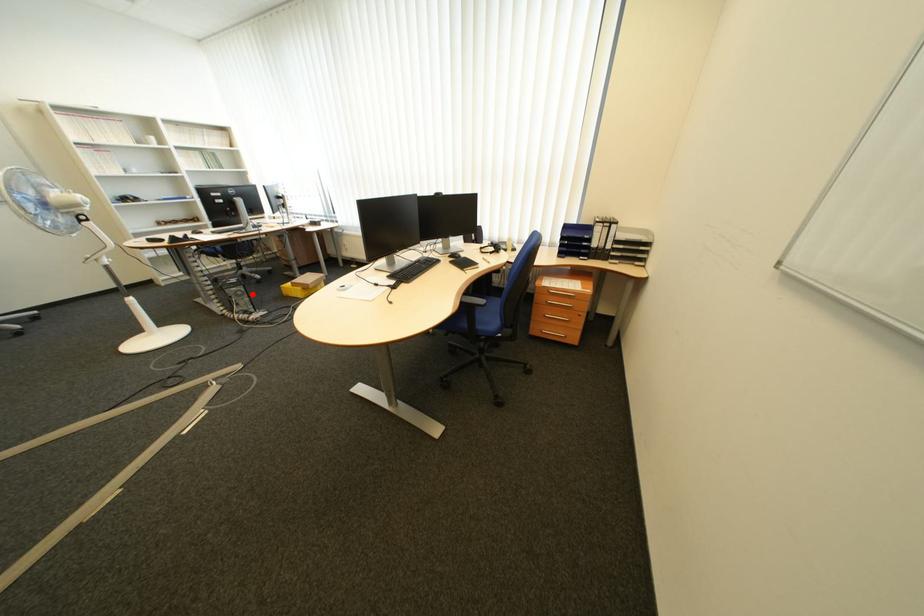
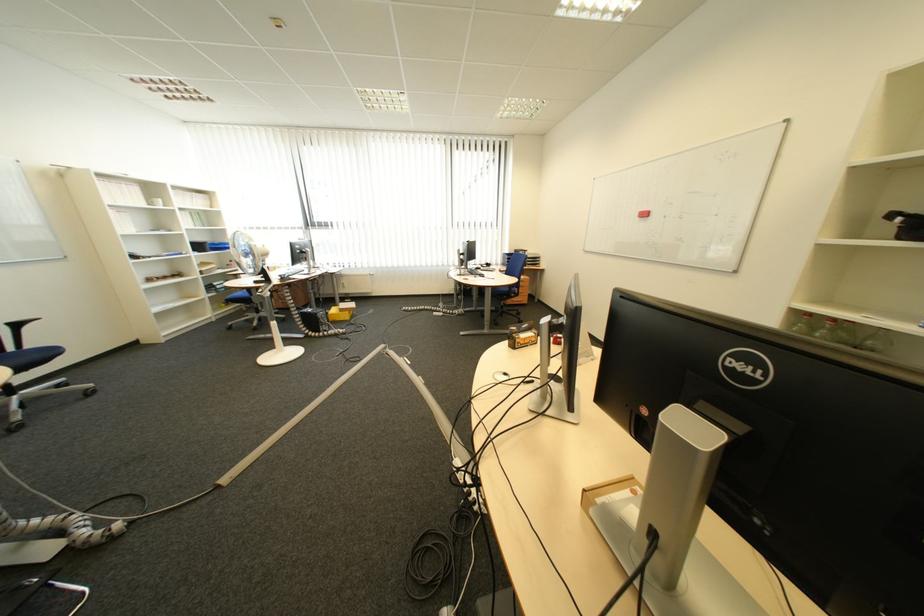
Question: I am providing you with two images of the same scene from different viewpoints. A red point is marked on the first image. Is the red point's position out of view in image 2?

Choices:
 (A) Yes
 (B) No

Answer: (B)